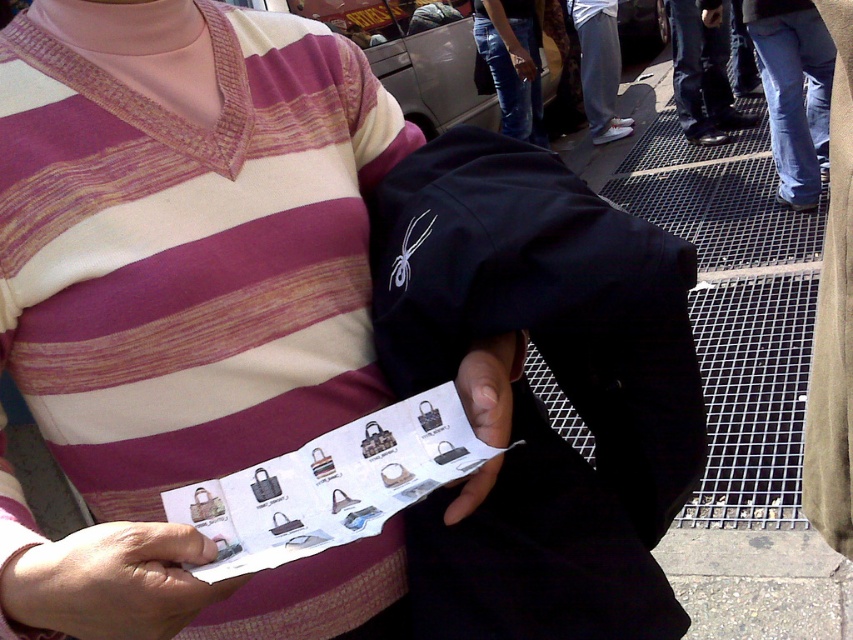
Between matte black bag at lower center and matte black bag at center, which one appears on the right side from the viewer's perspective?

From the viewer's perspective, matte black bag at center appears more on the right side.

Is matte black bag at lower center smaller than matte black bag at center?

Indeed, matte black bag at lower center has a smaller size compared to matte black bag at center.

Who is more distant from viewer, (x=498, y=385) or (x=518, y=68)?

The point (x=518, y=68) is more distant.

Where is `matte black bag at lower center`? This screenshot has width=853, height=640. matte black bag at lower center is located at coordinates (490, 387).

Image resolution: width=853 pixels, height=640 pixels. What do you see at coordinates (701, 76) in the screenshot?
I see `black leather shoes at lower right` at bounding box center [701, 76].

Which is behind, point (729, 129) or point (503, 429)?

The point (729, 129) is behind.

Find the location of a particular element. The image size is (853, 640). black leather shoes at lower right is located at coordinates (701, 76).

Who is more forward, (531, 1) or (612, 54)?

Point (531, 1) is more forward.

Between point (529, 88) and point (572, 17), which one is positioned in front?

Point (529, 88)

Where is `jeans at center`? The width and height of the screenshot is (853, 640). jeans at center is located at coordinates (512, 64).